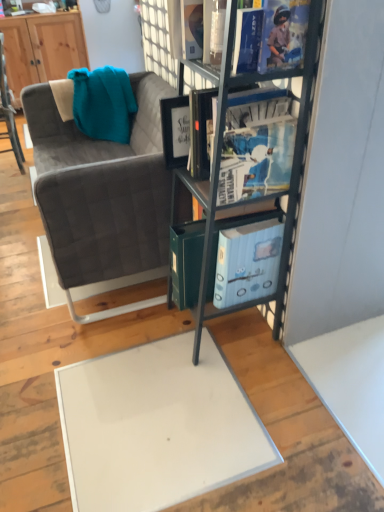
What is the approximate width of wooden cabinet at upper left?

wooden cabinet at upper left is 13.08 inches wide.

At what (x,y) coordinates should I click in order to perform the action: click on metallic gray bookshelf at center. Please return your answer as a coordinate pair (x, y). The image size is (384, 512). Looking at the image, I should click on point(219,170).

I want to click on velvet grey couch at left, so click(102, 191).

Consider the image. Who is shorter, metallic gray bookshelf at center or velvet grey chair at left?

With less height is velvet grey chair at left.

Can you tell me how much metallic gray bookshelf at center and velvet grey chair at left differ in facing direction?

0.926 degrees separate the facing orientations of metallic gray bookshelf at center and velvet grey chair at left.

How far apart are metallic gray bookshelf at center and velvet grey chair at left?

2.19 meters.

Is metallic gray bookshelf at center oriented towards velvet grey chair at left?

No, metallic gray bookshelf at center is not oriented towards velvet grey chair at left.

Between wooden cabinet at upper left and velvet grey chair at left, which one has smaller size?

Smaller between the two is velvet grey chair at left.

Which is nearer, [46,15] or [16,146]?

The point [16,146] is in front.

There is a velvet grey chair at left. In order to click on cabinetry above it (from a real-world perspective) in this screenshot , I will do (42, 48).

In the scene shown: Is velvet grey chair at left completely or partially inside wooden cabinet at upper left?

That's incorrect, velvet grey chair at left is not inside wooden cabinet at upper left.

Between blue glossy book at upper center and velvet grey chair at left, which one has less height?

blue glossy book at upper center.

Does point (268, 192) come in front of point (4, 104)?

That is True.

Is blue glossy book at upper center bigger or smaller than velvet grey chair at left?

blue glossy book at upper center is smaller than velvet grey chair at left.

Is blue glossy book at upper center spatially inside velvet grey chair at left, or outside of it?

blue glossy book at upper center is not enclosed by velvet grey chair at left.

From the image's perspective, is blue glossy book at upper center above or below metallic gray bookshelf at center?

blue glossy book at upper center is above metallic gray bookshelf at center.

Is blue glossy book at upper center oriented towards metallic gray bookshelf at center?

Yes.

Does point (259, 185) come in front of point (316, 52)?

No, (259, 185) is further to viewer.

Which is behind, point (103, 226) or point (33, 46)?

Positioned behind is point (33, 46).

From the image's perspective, between velvet grey couch at left and wooden cabinet at upper left, which one is located above?

wooden cabinet at upper left is shown above in the image.

What's the angular difference between velvet grey couch at left and wooden cabinet at upper left's facing directions?

velvet grey couch at left and wooden cabinet at upper left are facing 89.5 degrees away from each other.

In the scene shown: Is velvet grey couch at left further to the viewer compared to wooden cabinet at upper left?

That is False.

In the scene shown: From the image's perspective, is wooden cabinet at upper left under velvet grey couch at left?

No, from the image's perspective, wooden cabinet at upper left is not beneath velvet grey couch at left.

Considering the sizes of objects wooden cabinet at upper left and velvet grey couch at left in the image provided, who is taller, wooden cabinet at upper left or velvet grey couch at left?

wooden cabinet at upper left is taller.

Is wooden cabinet at upper left turned away from velvet grey couch at left?

No, wooden cabinet at upper left's orientation is not away from velvet grey couch at left.

Is blue glossy book at upper center not near velvet grey couch at left?

Indeed, blue glossy book at upper center is not near velvet grey couch at left.

Do you think blue glossy book at upper center is within velvet grey couch at left, or outside of it?

blue glossy book at upper center is located beyond the bounds of velvet grey couch at left.

Consider the image. Is blue glossy book at upper center looking in the opposite direction of velvet grey couch at left?

blue glossy book at upper center is not turned away from velvet grey couch at left.

Can you confirm if blue glossy book at upper center is thinner than velvet grey couch at left?

Correct, the width of blue glossy book at upper center is less than that of velvet grey couch at left.

Where is `shelf on the right of the velvet grey chair at left`? shelf on the right of the velvet grey chair at left is located at coordinates (219, 170).

The height and width of the screenshot is (512, 384). Find the location of `chair in front of the wooden cabinet at upper left`. chair in front of the wooden cabinet at upper left is located at coordinates (8, 111).

Which object lies further to the anchor point wooden cabinet at upper left, velvet grey couch at left or velvet grey chair at left?

Based on the image, velvet grey couch at left appears to be further to wooden cabinet at upper left.

When comparing their distances from velvet grey couch at left, does wooden cabinet at upper left or metallic gray bookshelf at center seem further?

wooden cabinet at upper left lies further to velvet grey couch at left than the other object.

When comparing their distances from wooden cabinet at upper left, does blue glossy book at upper center or metallic gray bookshelf at center seem further?

Among the two, blue glossy book at upper center is located further to wooden cabinet at upper left.

Looking at the image, which one is located closer to metallic gray bookshelf at center, velvet grey couch at left or velvet grey chair at left?

The object closer to metallic gray bookshelf at center is velvet grey couch at left.

Looking at the image, which one is located further to metallic gray bookshelf at center, velvet grey couch at left or blue glossy book at upper center?

velvet grey couch at left is further to metallic gray bookshelf at center.

Estimate the real-world distances between objects in this image. Which object is closer to blue glossy book at upper center, velvet grey couch at left or velvet grey chair at left?

velvet grey couch at left.

From the image, which object appears to be farther from velvet grey chair at left, blue glossy book at upper center or wooden cabinet at upper left?

blue glossy book at upper center is positioned further to the anchor velvet grey chair at left.

Looking at this image, from the image, which object appears to be nearer to velvet grey chair at left, velvet grey couch at left or metallic gray bookshelf at center?

velvet grey couch at left.

At what (x,y) coordinates should I click in order to perform the action: click on studio couch positioned between blue glossy book at upper center and wooden cabinet at upper left from near to far. Please return your answer as a coordinate pair (x, y). This screenshot has height=512, width=384. Looking at the image, I should click on (102, 191).

I want to click on chair between blue glossy book at upper center and wooden cabinet at upper left from front to back, so click(8, 111).

The image size is (384, 512). I want to click on studio couch positioned between metallic gray bookshelf at center and velvet grey chair at left from near to far, so click(102, 191).

I want to click on studio couch between metallic gray bookshelf at center and wooden cabinet at upper left from front to back, so click(102, 191).